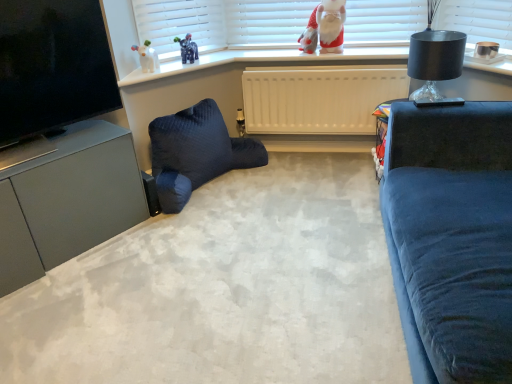
The image size is (512, 384). What are the coordinates of `vacant space in front of dark blue quilted bean bag chair at lower left` in the screenshot? It's located at (207, 235).